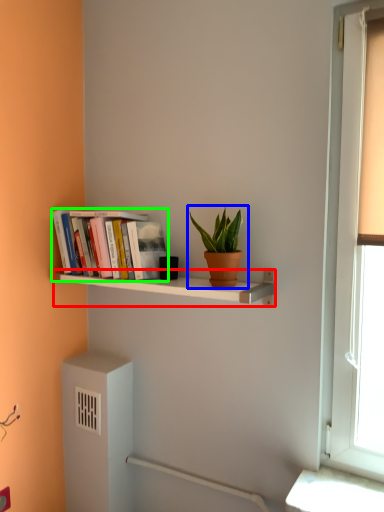
Question: Which object is positioned farthest from shelf (highlighted by a red box)? Select from houseplant (highlighted by a blue box) and book (highlighted by a green box).

Choices:
 (A) houseplant
 (B) book

Answer: (A)